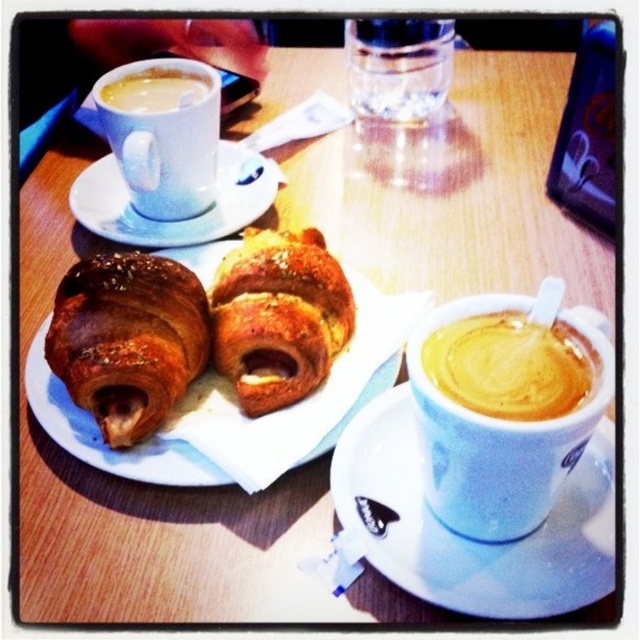
Can you confirm if golden frothy coffee at center is taller than golden brown croissant at center?

No.

In the scene shown: Between golden frothy coffee at center and golden brown croissant at center, which one appears on the left side from the viewer's perspective?

Positioned to the left is golden brown croissant at center.

Measure the distance between point (x=442, y=388) and camera.

A distance of 13.32 inches exists between point (x=442, y=388) and camera.

Find the location of `golden frothy coffee at center`. golden frothy coffee at center is located at coordinates (509, 365).

Which is above, white ceramic saucer at upper left or transparent glass at upper center?

transparent glass at upper center is higher up.

Who is positioned more to the right, white ceramic saucer at upper left or transparent glass at upper center?

Positioned to the right is transparent glass at upper center.

Does point (76, 198) come farther from viewer compared to point (352, 52)?

No, it is not.

The width and height of the screenshot is (640, 640). Identify the location of white ceramic saucer at upper left. (180, 220).

Based on the photo, between golden brown croissant at center and matte white cup at upper left, which one appears on the left side from the viewer's perspective?

From the viewer's perspective, matte white cup at upper left appears more on the left side.

This screenshot has height=640, width=640. What do you see at coordinates (99, 435) in the screenshot?
I see `golden brown croissant at center` at bounding box center [99, 435].

Describe the element at coordinates (99, 435) in the screenshot. This screenshot has width=640, height=640. I see `golden brown croissant at center` at that location.

You are a GUI agent. You are given a task and a screenshot of the screen. Output one action in this format:
    pyautogui.click(x=<x>, y=<y>)
    Task: Click on the golden brown croissant at center
    
    Given the screenshot: What is the action you would take?
    pyautogui.click(x=99, y=435)